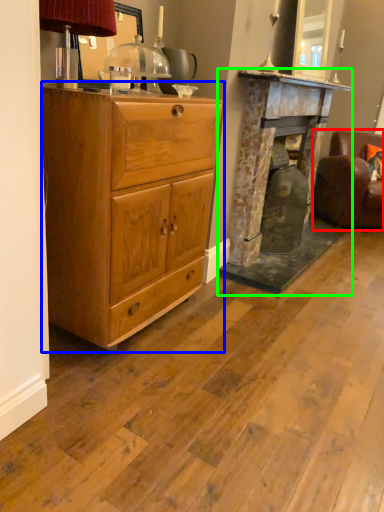
Question: Which object is the closest to the swivel chair (highlighted by a red box)? Choose among these: chest of drawers (highlighted by a blue box) or fireplace (highlighted by a green box).

Choices:
 (A) chest of drawers
 (B) fireplace

Answer: (B)